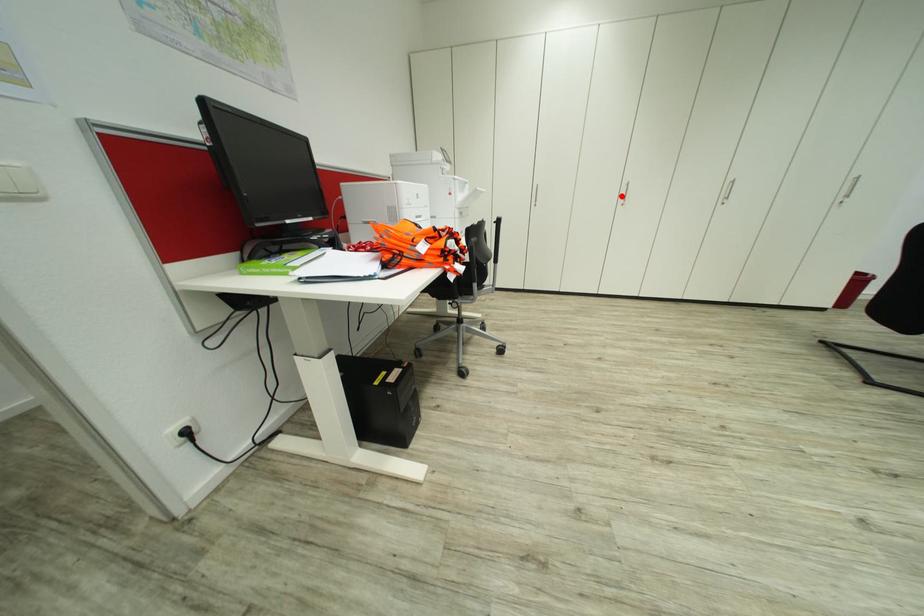
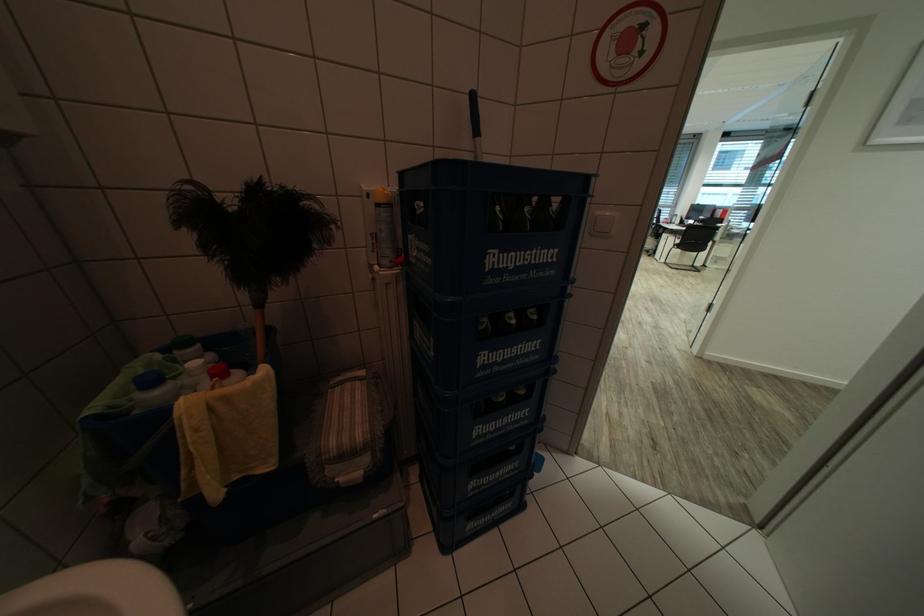
Question: I am providing you with two images of the same scene from different viewpoints. A red point is marked on the first image. At the location where the point appears in image 1, is it still visible in image 2?

Choices:
 (A) Yes
 (B) No

Answer: (B)